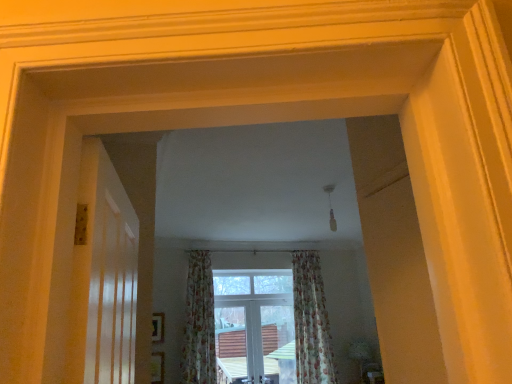
The width and height of the screenshot is (512, 384). What do you see at coordinates (199, 322) in the screenshot?
I see `floral fabric curtain at center, arranged as the second curtain when viewed from the right` at bounding box center [199, 322].

From the picture: Measure the distance between point (214,336) and camera.

Point (214,336) is 5.76 meters away from camera.

The width and height of the screenshot is (512, 384). Find the location of `clear glass window at center`. clear glass window at center is located at coordinates (255, 326).

Find the location of `floral fabric curtain at center, which is counted as the first curtain, starting from the right`. floral fabric curtain at center, which is counted as the first curtain, starting from the right is located at coordinates (311, 322).

Find the location of a particular element. floral fabric curtain at center, arranged as the second curtain when viewed from the right is located at coordinates [199, 322].

Image resolution: width=512 pixels, height=384 pixels. What are the coordinates of `curtain that is the 2nd object located in front of the clear glass window at center` in the screenshot? It's located at (199, 322).

Can you confirm if clear glass window at center is wider than floral fabric curtain at center, the first curtain positioned from the left?

Incorrect, the width of clear glass window at center does not surpass that of floral fabric curtain at center, the first curtain positioned from the left.

Between clear glass window at center and floral fabric curtain at center, the first curtain positioned from the left, which one has less height?

clear glass window at center.

Does clear glass window at center contain floral fabric curtain at center, the first curtain positioned from the left?

That's incorrect, floral fabric curtain at center, the first curtain positioned from the left, is not inside clear glass window at center.

Which is more to the left, floral fabric curtain at center, arranged as the second curtain when viewed from the right, or floral fabric curtain at center, which is counted as the first curtain, starting from the right?

From the viewer's perspective, floral fabric curtain at center, arranged as the second curtain when viewed from the right, appears more on the left side.

Considering the positions of point (206, 346) and point (309, 324), is point (206, 346) closer or farther from the camera than point (309, 324)?

Point (206, 346) appears to be closer to the viewer than point (309, 324).

What are the coordinates of `curtain lying above the floral fabric curtain at center, which is counted as the second curtain, starting from the left (from the image's perspective)` in the screenshot? It's located at (199, 322).

Is the depth of floral fabric curtain at center, the first curtain positioned from the left, greater than that of floral fabric curtain at center, which is counted as the first curtain, starting from the right?

No.

Consider the image. Does floral fabric curtain at center, which is counted as the second curtain, starting from the left, have a smaller size compared to floral fabric curtain at center, arranged as the second curtain when viewed from the right?

No, floral fabric curtain at center, which is counted as the second curtain, starting from the left, is not smaller than floral fabric curtain at center, arranged as the second curtain when viewed from the right.

Is floral fabric curtain at center, which is counted as the second curtain, starting from the left, surrounding floral fabric curtain at center, arranged as the second curtain when viewed from the right?

No, floral fabric curtain at center, which is counted as the second curtain, starting from the left, does not contain floral fabric curtain at center, arranged as the second curtain when viewed from the right.

From the image's perspective, is floral fabric curtain at center, which is counted as the first curtain, starting from the right, over floral fabric curtain at center, the first curtain positioned from the left?

No, from the image's perspective, floral fabric curtain at center, which is counted as the first curtain, starting from the right, is not above floral fabric curtain at center, the first curtain positioned from the left.

Where is `curtain below the floral fabric curtain at center, the first curtain positioned from the left (from the image's perspective)`? curtain below the floral fabric curtain at center, the first curtain positioned from the left (from the image's perspective) is located at coordinates (311, 322).

Visually, is floral fabric curtain at center, which is counted as the first curtain, starting from the right, positioned to the left or to the right of clear glass window at center?

Clearly, floral fabric curtain at center, which is counted as the first curtain, starting from the right, is on the right of clear glass window at center in the image.

From a real-world perspective, is floral fabric curtain at center, which is counted as the second curtain, starting from the left, physically located above or below clear glass window at center?

In terms of real-world spatial position, floral fabric curtain at center, which is counted as the second curtain, starting from the left, is above clear glass window at center.

Considering the sizes of floral fabric curtain at center, which is counted as the first curtain, starting from the right, and clear glass window at center in the image, is floral fabric curtain at center, which is counted as the first curtain, starting from the right, bigger or smaller than clear glass window at center?

In the image, floral fabric curtain at center, which is counted as the first curtain, starting from the right, appears to be larger than clear glass window at center.

In the scene shown: Which object is thinner, floral fabric curtain at center, the first curtain positioned from the left, or clear glass window at center?

clear glass window at center is thinner.

Is floral fabric curtain at center, the first curtain positioned from the left, not within clear glass window at center?

Yes, floral fabric curtain at center, the first curtain positioned from the left, is located beyond the bounds of clear glass window at center.

Which is closer to the camera, (198,357) or (261,317)?

Positioned in front is point (198,357).

At what (x,y) coordinates should I click in order to perform the action: click on window located behind the floral fabric curtain at center, the first curtain positioned from the left. Please return your answer as a coordinate pair (x, y). Image resolution: width=512 pixels, height=384 pixels. Looking at the image, I should click on [x=255, y=326].

Does clear glass window at center have a lesser width compared to floral fabric curtain at center, which is counted as the second curtain, starting from the left?

Yes, clear glass window at center is thinner than floral fabric curtain at center, which is counted as the second curtain, starting from the left.

Are clear glass window at center and floral fabric curtain at center, which is counted as the first curtain, starting from the right, making contact?

No, clear glass window at center is not next to floral fabric curtain at center, which is counted as the first curtain, starting from the right.

Considering the sizes of clear glass window at center and floral fabric curtain at center, which is counted as the second curtain, starting from the left, in the image, is clear glass window at center bigger or smaller than floral fabric curtain at center, which is counted as the second curtain, starting from the left,?

Considering their sizes, clear glass window at center takes up less space than floral fabric curtain at center, which is counted as the second curtain, starting from the left.

From a real-world perspective, is clear glass window at center above or below floral fabric curtain at center, which is counted as the second curtain, starting from the left?

Clearly, from a real-world perspective, clear glass window at center is below floral fabric curtain at center, which is counted as the second curtain, starting from the left.

Locate an element on the screen. This screenshot has height=384, width=512. curtain on the left of the clear glass window at center is located at coordinates (199, 322).

At what (x,y) coordinates should I click in order to perform the action: click on curtain behind the floral fabric curtain at center, arranged as the second curtain when viewed from the right. Please return your answer as a coordinate pair (x, y). Looking at the image, I should click on (311, 322).

Estimate the real-world distances between objects in this image. Which object is further from floral fabric curtain at center, which is counted as the second curtain, starting from the left, floral fabric curtain at center, the first curtain positioned from the left, or clear glass window at center?

floral fabric curtain at center, the first curtain positioned from the left, is further to floral fabric curtain at center, which is counted as the second curtain, starting from the left.

In the scene shown: Estimate the real-world distances between objects in this image. Which object is closer to clear glass window at center, floral fabric curtain at center, arranged as the second curtain when viewed from the right, or floral fabric curtain at center, which is counted as the first curtain, starting from the right?

floral fabric curtain at center, which is counted as the first curtain, starting from the right, is positioned closer to the anchor clear glass window at center.

Looking at the image, which one is located further to floral fabric curtain at center, the first curtain positioned from the left, floral fabric curtain at center, which is counted as the second curtain, starting from the left, or clear glass window at center?

floral fabric curtain at center, which is counted as the second curtain, starting from the left, lies further to floral fabric curtain at center, the first curtain positioned from the left, than the other object.

Estimate the real-world distances between objects in this image. Which object is further from floral fabric curtain at center, the first curtain positioned from the left, clear glass window at center or floral fabric curtain at center, which is counted as the first curtain, starting from the right?

floral fabric curtain at center, which is counted as the first curtain, starting from the right.

When comparing their distances from clear glass window at center, does floral fabric curtain at center, which is counted as the second curtain, starting from the left, or floral fabric curtain at center, the first curtain positioned from the left, seem closer?

floral fabric curtain at center, which is counted as the second curtain, starting from the left, lies closer to clear glass window at center than the other object.

When comparing their distances from floral fabric curtain at center, which is counted as the first curtain, starting from the right, does clear glass window at center or floral fabric curtain at center, the first curtain positioned from the left, seem further?

floral fabric curtain at center, the first curtain positioned from the left, lies further to floral fabric curtain at center, which is counted as the first curtain, starting from the right, than the other object.

Locate an element on the screen. The width and height of the screenshot is (512, 384). window between floral fabric curtain at center, arranged as the second curtain when viewed from the right, and floral fabric curtain at center, which is counted as the first curtain, starting from the right, from left to right is located at coordinates click(255, 326).